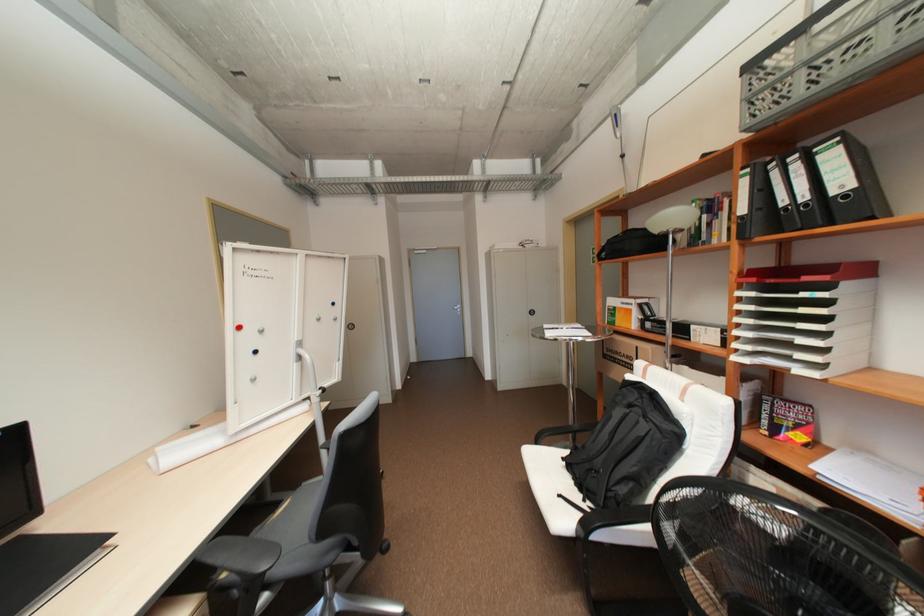
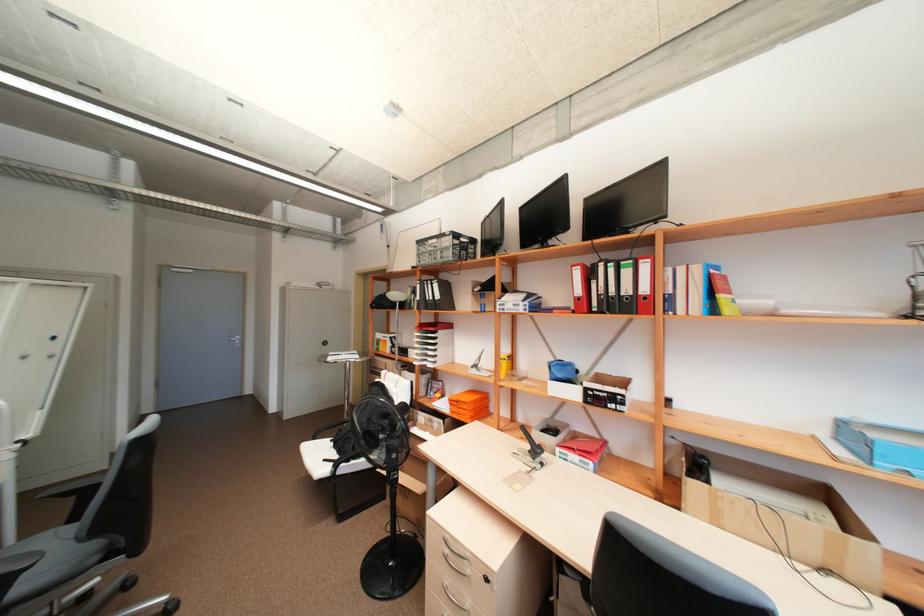
In the second image, find the point that corresponds to (x=742, y=83) in the first image.

(420, 246)